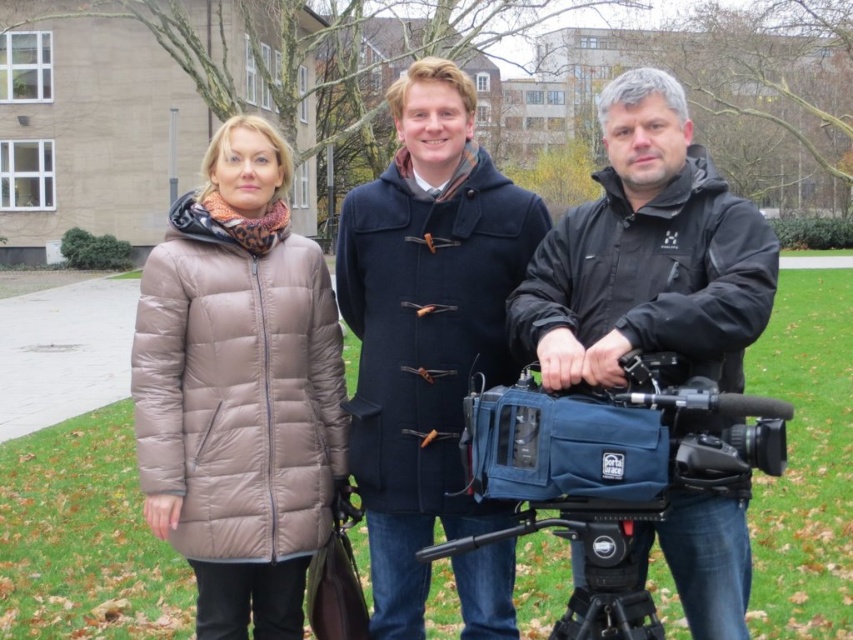
Which of these two, blue fabric camera at center or black plastic tripod at lower center, stands taller?

blue fabric camera at center

Is blue fabric camera at center taller than black plastic tripod at lower center?

Indeed, blue fabric camera at center has a greater height compared to black plastic tripod at lower center.

The image size is (853, 640). Identify the location of blue fabric camera at center. (616, 440).

Between point (363, 336) and point (523, 477), which one is positioned behind?

The point (363, 336) is behind.

The height and width of the screenshot is (640, 853). What do you see at coordinates (426, 326) in the screenshot?
I see `navy wool coat at center` at bounding box center [426, 326].

Is point (412, 100) more distant than point (585, 600)?

Yes, point (412, 100) is behind point (585, 600).

Where is `navy wool coat at center`? navy wool coat at center is located at coordinates (426, 326).

Is matte brown coat at center positioned at the back of blue fabric video camera at lower right?

That is True.

Can you confirm if matte brown coat at center is bigger than blue fabric video camera at lower right?

Yes.

I want to click on matte brown coat at center, so click(x=645, y=257).

Where is `matte brown coat at center`? This screenshot has width=853, height=640. matte brown coat at center is located at coordinates (645, 257).